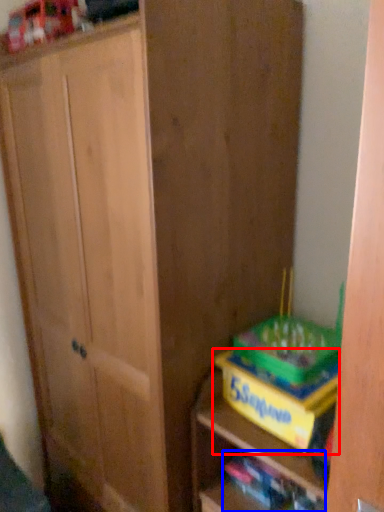
Question: Which object appears closest to the camera in this image, cabinetry (highlighted by a red box) or book (highlighted by a blue box)?

Choices:
 (A) cabinetry
 (B) book

Answer: (A)